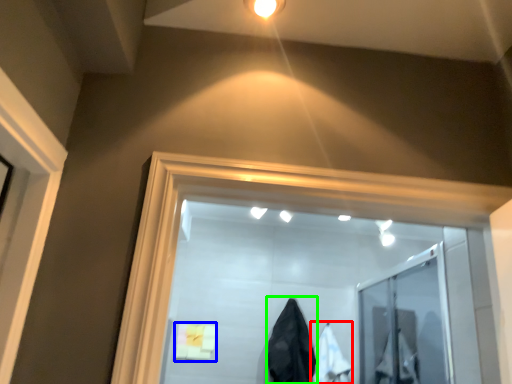
Question: Which object is positioned closest to garment (highlighted by a red box)? Select from bath towel (highlighted by a blue box) and garment (highlighted by a green box).

Choices:
 (A) bath towel
 (B) garment

Answer: (B)